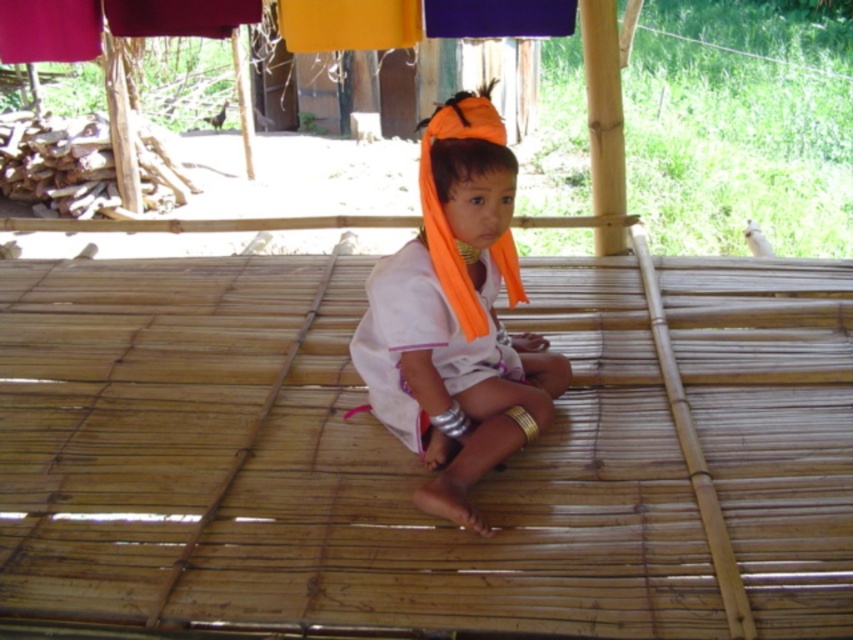
Question: Is orange fabric headband at center behind white cotton robe at center?

Choices:
 (A) no
 (B) yes

Answer: (A)

Question: Does orange fabric headband at center come in front of white cotton robe at center?

Choices:
 (A) yes
 (B) no

Answer: (A)

Question: Which of the following is the farthest from the observer?

Choices:
 (A) white cotton robe at center
 (B) orange fabric headband at center

Answer: (A)

Question: Among these objects, which one is farthest from the camera?

Choices:
 (A) orange fabric headband at center
 (B) white cotton robe at center

Answer: (B)

Question: Is the position of orange fabric headband at center more distant than that of white cotton robe at center?

Choices:
 (A) no
 (B) yes

Answer: (A)